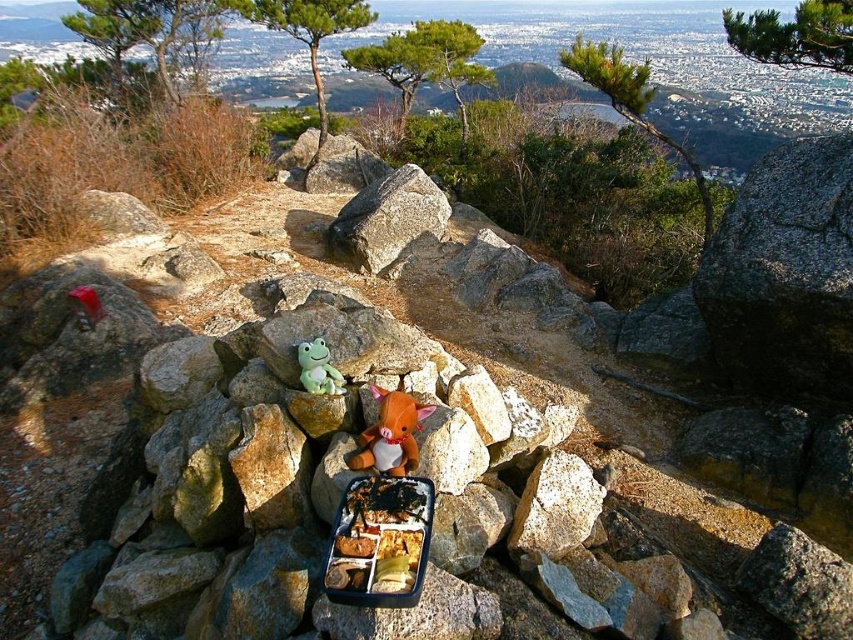
You are a delivery drone carrying a package that requires a landing zone at least 2 meters in diameter. You need to land between the gray granite rock at center and the green plush frog at center. Is this possible?

The gray granite rock at center is 1.95 meters away from the green plush frog at center, so the distance between them is less than 2 meters. Therefore, the landing zone between them is not large enough for the drone to land safely.